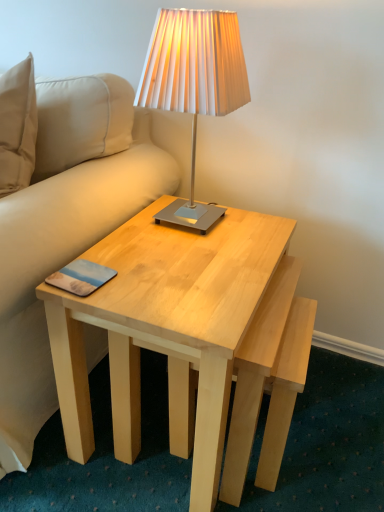
You are a GUI agent. You are given a task and a screenshot of the screen. Output one action in this format:
    pyautogui.click(x=<x>, y=<y>)
    Task: Click on the free space below matte silver lamp at upper center (from a real-world perspective)
    The height and width of the screenshot is (512, 384).
    Given the screenshot: What is the action you would take?
    (x=197, y=227)